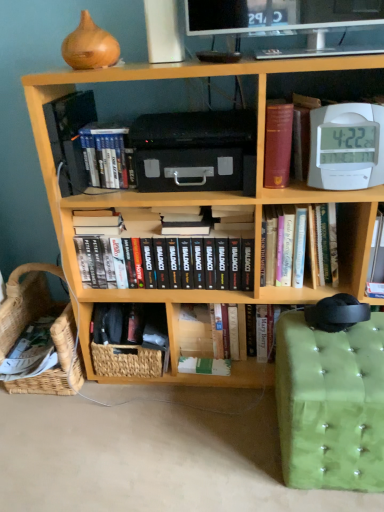
Find the location of a particular element. This screenshot has width=384, height=512. empty space that is ontop of green tufted fabric swivel chair at lower right (from a real-world perspective) is located at coordinates click(x=342, y=347).